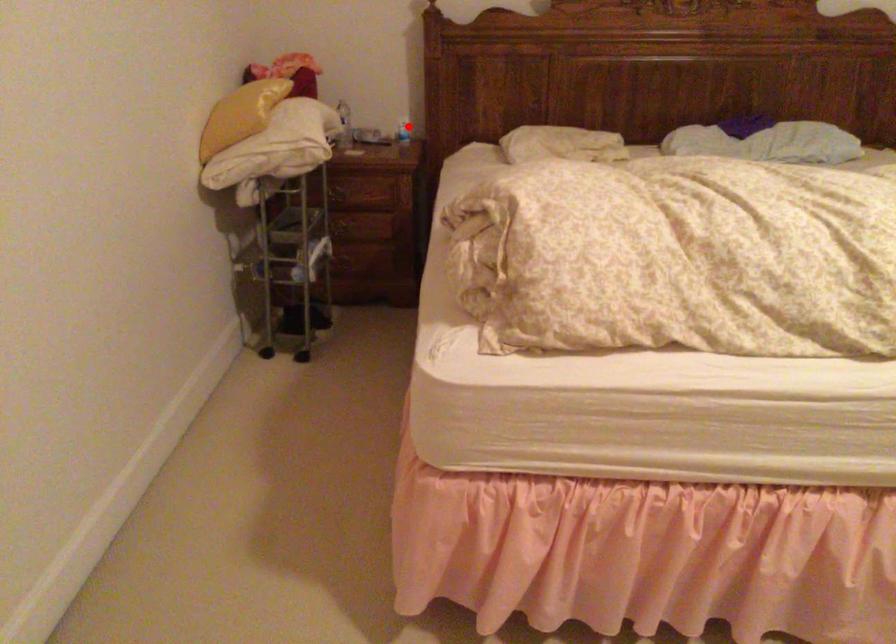
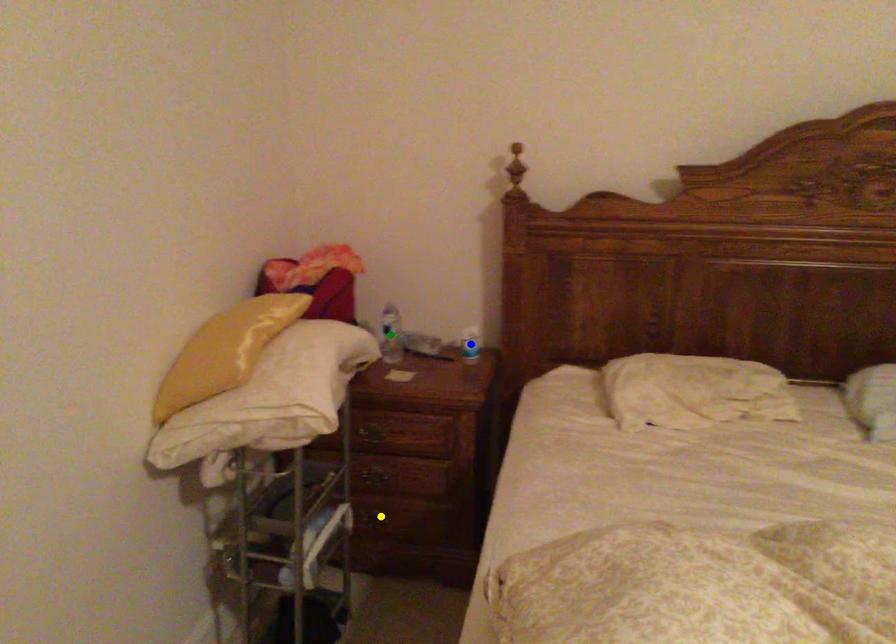
Question: I am providing you with two images of the same scene from different viewpoints. A red point is marked on the first image. You are given multiple points on the second image. Which spot in image 2 lines up with the point in image 1?

Choices:
 (A) yellow point
 (B) blue point
 (C) green point

Answer: (B)